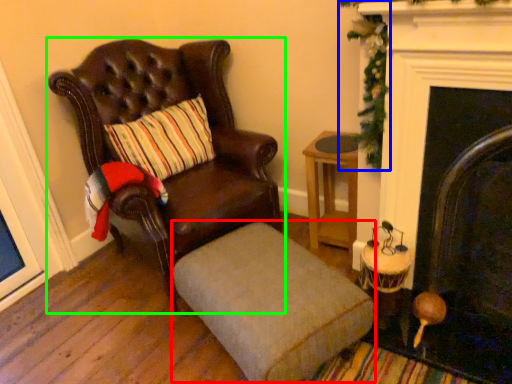
Question: Estimate the real-world distances between objects in this image. Which object is farther from footrest (highlighted by a red box), christmas decoration (highlighted by a blue box) or chair (highlighted by a green box)?

Choices:
 (A) christmas decoration
 (B) chair

Answer: (A)